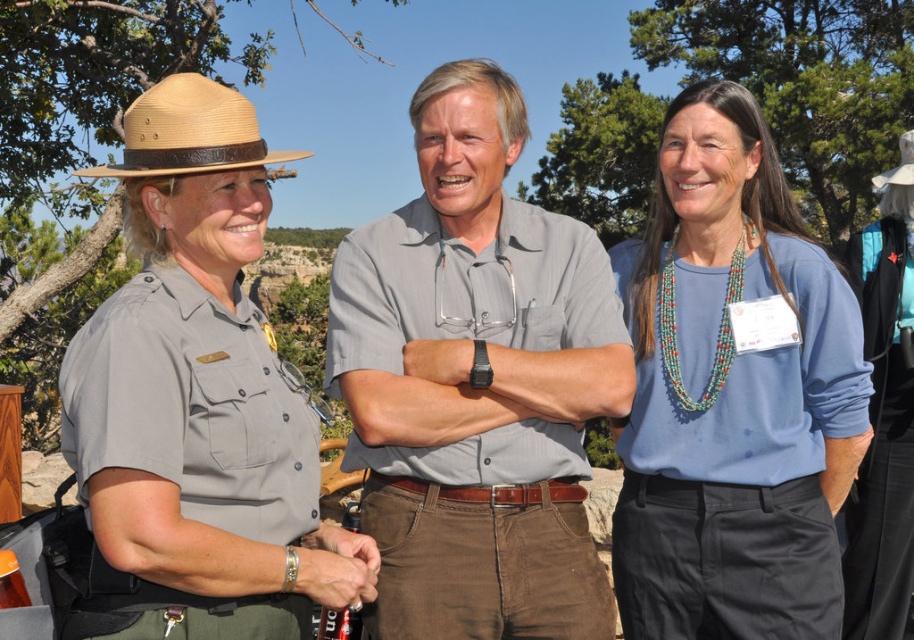
You are a park visitor who wants to know which object is shorter between the metallic silver pen at center and the straw hat at center. Can you tell me?

The metallic silver pen at center is not as tall as the straw hat at center, so the metallic silver pen at center is shorter.

You are a visitor at the park and see the metallic silver pen at center and the straw hat at center. Which item is positioned more to the left?

The metallic silver pen at center is positioned more to the left than the straw hat at center.

You are a photographer trying to capture a closeup of the metallic silver pen at center without including the matte gray uniform at center in the frame. Given that your camera has a minimum focusing distance of 40 centimeters, will you be able to achieve this?

The matte gray uniform at center is 39.62 centimeters away from metallic silver pen at center. Since your camera can only focus as close as 40 centimeters, you will not be able to capture the metallic silver pen at center without including the matte gray uniform at center in the frame.